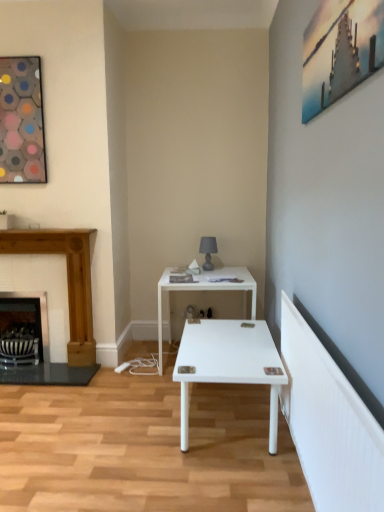
Question: From the image's perspective, is black metal fireplace at left, the 1th fireplace when ordered from left to right, above wooden fireplace at left, which ranks as the 1th fireplace in right-to-left order?

Choices:
 (A) no
 (B) yes

Answer: (A)

Question: Could you tell me if black metal fireplace at left, the 1th fireplace when ordered from left to right, is turned towards wooden fireplace at left, which appears as the second fireplace when viewed from the left?

Choices:
 (A) yes
 (B) no

Answer: (A)

Question: Is black metal fireplace at left, the 2th fireplace from the right, closer to camera compared to wooden fireplace at left, which appears as the second fireplace when viewed from the left?

Choices:
 (A) no
 (B) yes

Answer: (A)

Question: Can you confirm if black metal fireplace at left, the 1th fireplace when ordered from left to right, is thinner than wooden fireplace at left, which ranks as the 1th fireplace in right-to-left order?

Choices:
 (A) yes
 (B) no

Answer: (A)

Question: Is black metal fireplace at left, the 2th fireplace from the right, bigger than wooden fireplace at left, which ranks as the 1th fireplace in right-to-left order?

Choices:
 (A) no
 (B) yes

Answer: (A)

Question: In the image, is white glossy table at center on the left side or the right side of metallic silver swivel chair at lower left?

Choices:
 (A) left
 (B) right

Answer: (B)

Question: Is white glossy table at center taller or shorter than metallic silver swivel chair at lower left?

Choices:
 (A) short
 (B) tall

Answer: (B)

Question: Relative to metallic silver swivel chair at lower left, is white glossy table at center in front or behind?

Choices:
 (A) behind
 (B) front

Answer: (B)

Question: Is white glossy table at center wider or thinner than metallic silver swivel chair at lower left?

Choices:
 (A) wide
 (B) thin

Answer: (A)

Question: Does point (21, 327) appear closer or farther from the camera than point (23, 365)?

Choices:
 (A) farther
 (B) closer

Answer: (A)

Question: From a real-world perspective, relative to black metal fireplace at left, the 2th fireplace from the right, is metallic silver swivel chair at lower left vertically above or below?

Choices:
 (A) above
 (B) below

Answer: (B)

Question: Would you say metallic silver swivel chair at lower left is inside or outside black metal fireplace at left, the 2th fireplace from the right?

Choices:
 (A) inside
 (B) outside

Answer: (A)

Question: Considering the relative positions of metallic silver swivel chair at lower left and black metal fireplace at left, the 2th fireplace from the right, in the image provided, is metallic silver swivel chair at lower left to the left or to the right of black metal fireplace at left, the 2th fireplace from the right,?

Choices:
 (A) right
 (B) left

Answer: (B)

Question: Is black metal fireplace at left, the 1th fireplace when ordered from left to right, to the left or to the right of matte gray glass table lamp at center in the image?

Choices:
 (A) left
 (B) right

Answer: (A)

Question: Is black metal fireplace at left, the 2th fireplace from the right, bigger or smaller than matte gray glass table lamp at center?

Choices:
 (A) big
 (B) small

Answer: (A)